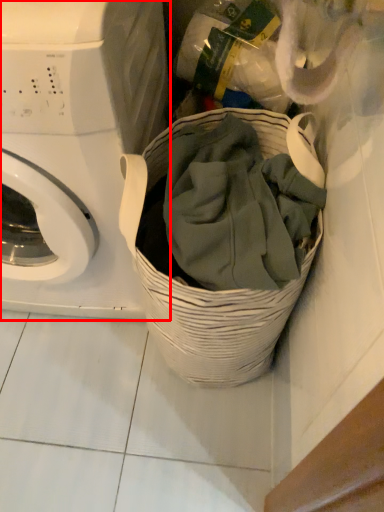
Question: From the image's perspective, what is the correct spatial relationship of washing machine (annotated by the red box) in relation to basket?

Choices:
 (A) above
 (B) below

Answer: (A)